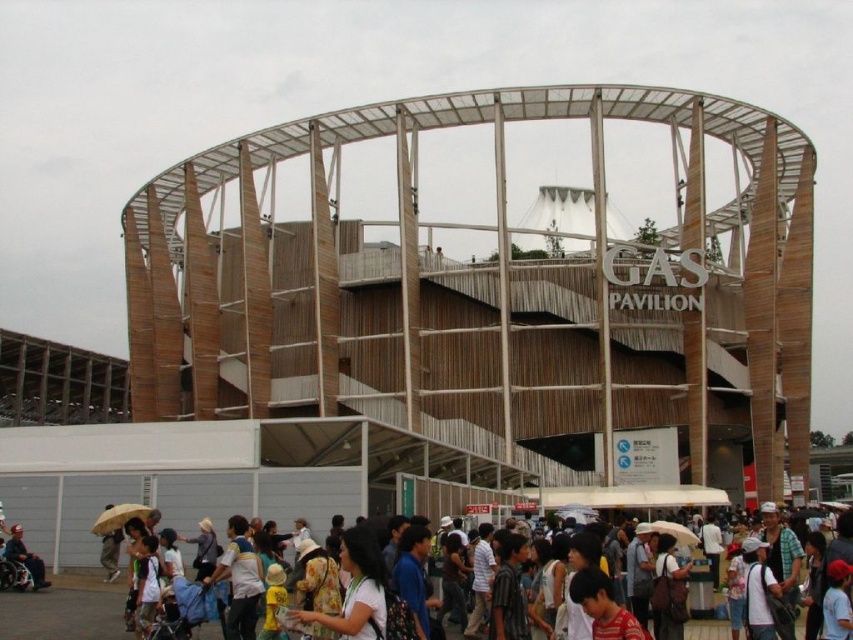
You are standing in front of the GAS PAVILION and want to take a photo. There are two points marked on the structure at coordinates point (39,584) and point (109,532). Which point should you focus on to ensure it appears larger in your photo?

Point (39,584) should be focused on because it is closer to the camera and will appear larger in the photo compared to point (109,532).

You are a person in a wheelchair who wants to approach the GAS PAVILION. You notice a dark gray fabric wheelchair at lower left and a yellow matte umbrella at lower left. Which object is taller, and does this affect your ability to see the pavilion from your current position?

The dark gray fabric wheelchair at lower left is taller than the yellow matte umbrella at lower left. Since the wheelchair is taller, it might block your view of the pavilion if positioned between you and the structure. Adjust your position to ensure an unobstructed view.

You are a person in a wheelchair who wants to move from the dark gray fabric wheelchair at lower left to the yellow matte umbrella at lower left. Is there enough space to move sideways between them?

The dark gray fabric wheelchair at lower left might be wider than yellow matte umbrella at lower left, so there may not be enough space to move sideways between them.